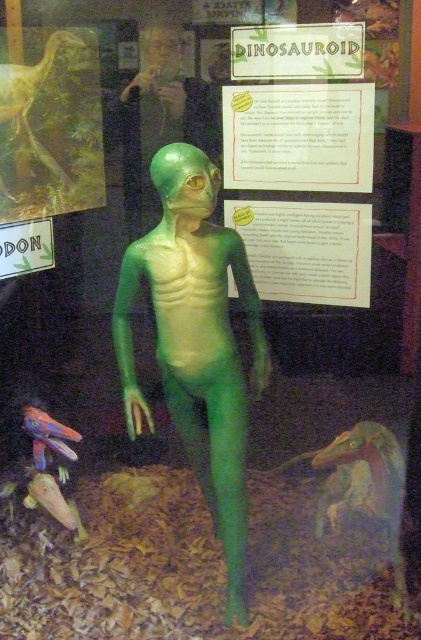
Question: Can you confirm if matte plastic sign at upper center is smaller than matte white sign at upper left?

Choices:
 (A) no
 (B) yes

Answer: (A)

Question: Considering the real-world distances, which object is farthest from the shiny purple dinosaur at lower left?

Choices:
 (A) matte white sign at upper left
 (B) white paper at center

Answer: (B)

Question: Which object is farther from the camera taking this photo?

Choices:
 (A) matte plastic sign at upper center
 (B) shiny purple dinosaur at lower left
 (C) white paper at center
 (D) green matte alien at center

Answer: (C)

Question: Can you confirm if matte plastic sign at upper center is bigger than green matte dinosaur at upper left?

Choices:
 (A) no
 (B) yes

Answer: (A)

Question: Is green matte dinosaur at upper left to the left of shiny purple dinosaur at lower left from the viewer's perspective?

Choices:
 (A) no
 (B) yes

Answer: (B)

Question: Which object appears farthest from the camera in this image?

Choices:
 (A) matte white sign at upper left
 (B) shiny purple dinosaur at lower left

Answer: (A)